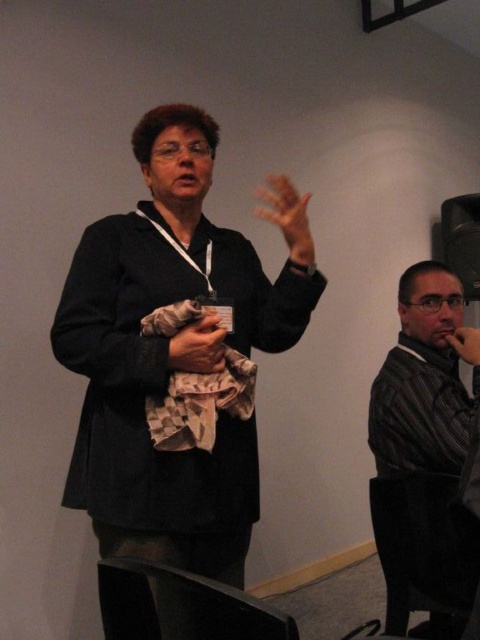
Question: Can you confirm if matte black jacket at center is bigger than matte black hand at center?

Choices:
 (A) yes
 (B) no

Answer: (A)

Question: Which is nearer to the striped fabric shirt at right?

Choices:
 (A) matte black hand at center
 (B) camouflage fabric hand at center

Answer: (B)

Question: Can you confirm if matte black jacket at center is smaller than matte black hand at center?

Choices:
 (A) yes
 (B) no

Answer: (B)

Question: Is matte black jacket at center behind striped fabric shirt at right?

Choices:
 (A) yes
 (B) no

Answer: (A)

Question: Which of these objects is positioned farthest from the smooth skin hand at right?

Choices:
 (A) camouflage fabric hand at center
 (B) matte black jacket at center
 (C) striped fabric shirt at right
 (D) matte black hand at center

Answer: (B)

Question: Which object appears farthest from the camera in this image?

Choices:
 (A) smooth skin hand at right
 (B) camouflage fabric hand at center
 (C) matte black jacket at center
 (D) striped fabric shirt at right

Answer: (A)